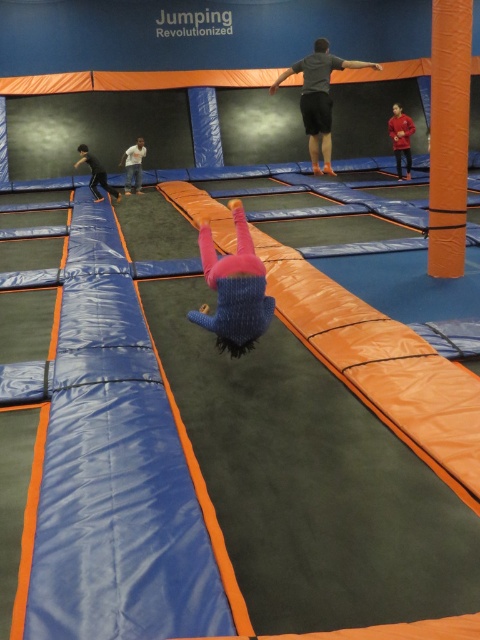
Can you confirm if red fleece jacket at upper right is smaller than white cotton shirt at upper center?

No, red fleece jacket at upper right is not smaller than white cotton shirt at upper center.

Is red fleece jacket at upper right further to camera compared to white cotton shirt at upper center?

No, red fleece jacket at upper right is in front of white cotton shirt at upper center.

What are the coordinates of `red fleece jacket at upper right` in the screenshot? It's located at (400, 138).

Is knitted pink pants at center further to camera compared to red fleece jacket at upper right?

No.

Between point (207, 225) and point (406, 125), which one is positioned behind?

The point (406, 125) is more distant.

Who is more forward, (253, 333) or (406, 173)?

Point (253, 333) is in front.

At what (x,y) coordinates should I click in order to perform the action: click on knitted pink pants at center. Please return your answer as a coordinate pair (x, y). The width and height of the screenshot is (480, 640). Looking at the image, I should click on (235, 289).

Can you confirm if gray fabric shorts at center is thinner than red fleece jacket at upper right?

No, gray fabric shorts at center is not thinner than red fleece jacket at upper right.

Is gray fabric shorts at center smaller than red fleece jacket at upper right?

Actually, gray fabric shorts at center might be larger than red fleece jacket at upper right.

Who is more forward, (290, 74) or (407, 129)?

Point (290, 74) is more forward.

Identify the location of gray fabric shorts at center. (319, 97).